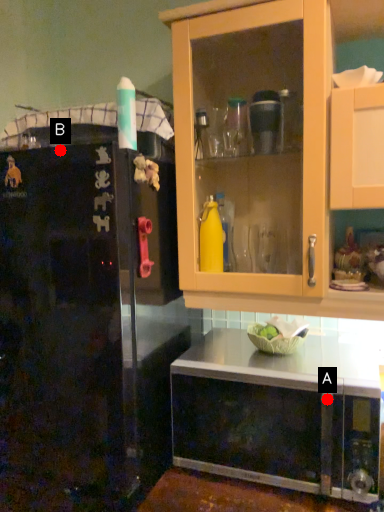
Question: Two points are circled on the image, labeled by A and B beside each circle. Which of the following is the farthest from the observer?

Choices:
 (A) A is further
 (B) B is further

Answer: (B)